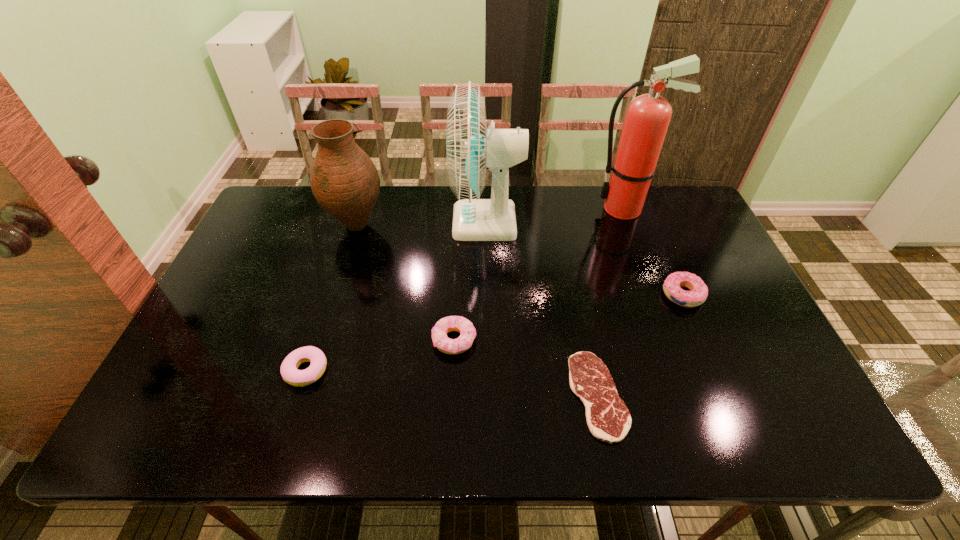
This screenshot has width=960, height=540. I want to click on fire extinguisher that is positioned at the far edge, so click(647, 118).

Where is `fan present at the far edge`? Image resolution: width=960 pixels, height=540 pixels. fan present at the far edge is located at coordinates (470, 147).

Locate an element on the screen. This screenshot has width=960, height=540. vase at the far edge is located at coordinates (344, 180).

Locate an element on the screen. The image size is (960, 540). object that is at the near edge is located at coordinates (608, 419).

I want to click on fire extinguisher at the right edge, so click(647, 118).

This screenshot has height=540, width=960. I want to click on doughnut located in the right edge section of the desktop, so click(698, 293).

You are a GUI agent. You are given a task and a screenshot of the screen. Output one action in this format:
    pyautogui.click(x=<x>, y=<y>)
    Task: Click on the object positioned at the far right corner
    The image size is (960, 540).
    Given the screenshot: What is the action you would take?
    pyautogui.click(x=647, y=118)

The width and height of the screenshot is (960, 540). Identify the location of free region at the far edge of the desktop. (589, 212).

Identify the location of free space at the near edge of the desktop. (328, 436).

In the image, there is a desktop. Where is `free region at the left edge`? free region at the left edge is located at coordinates (262, 326).